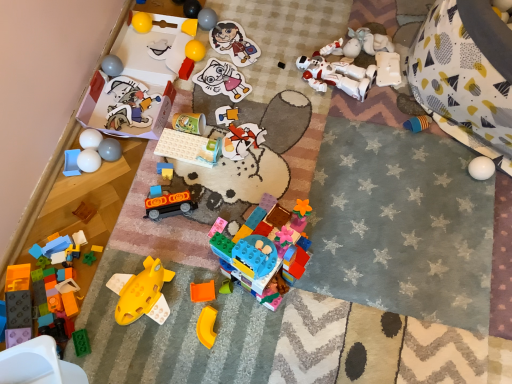
This screenshot has width=512, height=384. Identify the location of vacant space to the right of yellow matte block at center, which appears as the 13th toy when viewed from the right. (234, 37).